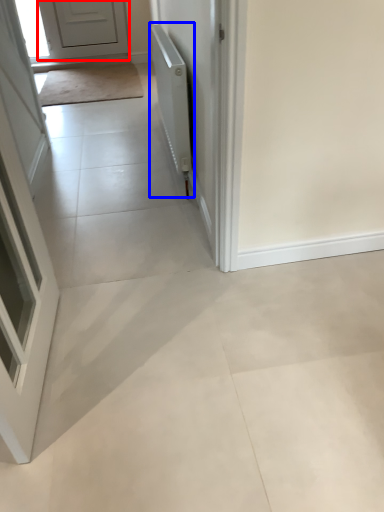
Question: Among these objects, which one is nearest to the camera, door (highlighted by a red box) or radiator (highlighted by a blue box)?

Choices:
 (A) door
 (B) radiator

Answer: (B)